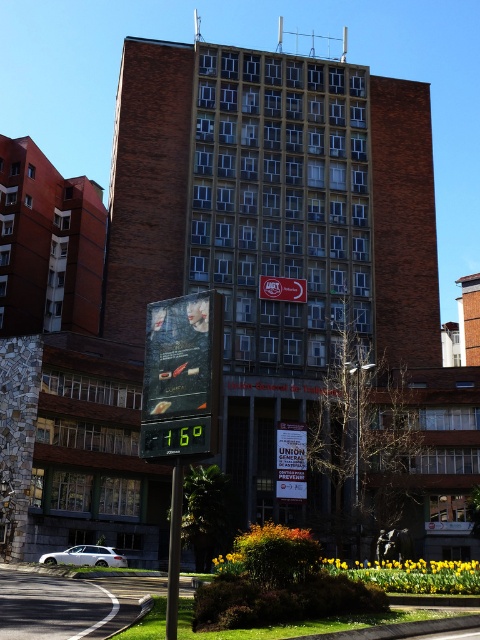
You are a delivery person trying to read the temperature from the green digital display at center. However, there is a black metal pole at lower center in the way. Can you see the temperature clearly?

The green digital display at center is bigger than the black metal pole at lower center, so the pole might block part of the display, making it difficult to read the temperature clearly.

You are standing in front of the residential building and looking at the thermometer sign and the billboard. Which of the two points, point (219, 364) or point (178, 483), is closer to your eyes?

Point (219, 364) is further to the camera than point (178, 483), so the point closer to your eyes is point (178, 483).